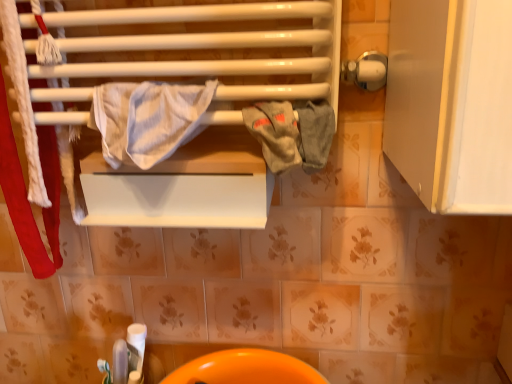
Question: Would you say gray cotton towel at center, the second bath towel when ordered from left to right, contains orange glossy sink at lower center?

Choices:
 (A) yes
 (B) no

Answer: (B)

Question: Does gray cotton towel at center, the second bath towel when ordered from left to right, have a larger size compared to orange glossy sink at lower center?

Choices:
 (A) yes
 (B) no

Answer: (B)

Question: Considering the relative sizes of gray cotton towel at center, the second bath towel when ordered from left to right, and orange glossy sink at lower center in the image provided, is gray cotton towel at center, the second bath towel when ordered from left to right, smaller than orange glossy sink at lower center?

Choices:
 (A) yes
 (B) no

Answer: (A)

Question: Considering the relative positions of gray cotton towel at center, the second bath towel when ordered from left to right, and orange glossy sink at lower center in the image provided, is gray cotton towel at center, the second bath towel when ordered from left to right, to the right of orange glossy sink at lower center from the viewer's perspective?

Choices:
 (A) no
 (B) yes

Answer: (B)

Question: Is gray cotton towel at center, the second bath towel when ordered from left to right, located outside orange glossy sink at lower center?

Choices:
 (A) no
 (B) yes

Answer: (B)

Question: From the image's perspective, relative to orange glossy sink at lower center, is gray cotton towel at center, which is the 1th bath towel from right to left, above or below?

Choices:
 (A) below
 (B) above

Answer: (B)

Question: In the image, is gray cotton towel at center, the second bath towel when ordered from left to right, positioned in front of or behind orange glossy sink at lower center?

Choices:
 (A) behind
 (B) front

Answer: (B)

Question: Is gray cotton towel at center, the second bath towel when ordered from left to right, taller or shorter than orange glossy sink at lower center?

Choices:
 (A) short
 (B) tall

Answer: (A)

Question: Considering the relative positions of gray cotton towel at center, the second bath towel when ordered from left to right, and orange glossy sink at lower center in the image provided, is gray cotton towel at center, the second bath towel when ordered from left to right, to the left or to the right of orange glossy sink at lower center?

Choices:
 (A) right
 (B) left

Answer: (A)

Question: From the image's perspective, is orange glossy sink at lower center positioned above or below white striped fabric at center, which appears as the 2th bath towel when viewed from the right?

Choices:
 (A) below
 (B) above

Answer: (A)

Question: From their relative heights in the image, would you say orange glossy sink at lower center is taller or shorter than white striped fabric at center, which is the first bath towel from left to right?

Choices:
 (A) short
 (B) tall

Answer: (A)

Question: Is point (292, 379) closer or farther from the camera than point (125, 127)?

Choices:
 (A) closer
 (B) farther

Answer: (B)

Question: Which is correct: orange glossy sink at lower center is inside white striped fabric at center, which appears as the 2th bath towel when viewed from the right, or outside of it?

Choices:
 (A) inside
 (B) outside

Answer: (B)

Question: From the image's perspective, is gray cotton towel at center, the second bath towel when ordered from left to right, above or below white striped fabric at center, which appears as the 2th bath towel when viewed from the right?

Choices:
 (A) above
 (B) below

Answer: (B)

Question: Considering the positions of gray cotton towel at center, the second bath towel when ordered from left to right, and white striped fabric at center, which is the first bath towel from left to right, in the image, is gray cotton towel at center, the second bath towel when ordered from left to right, bigger or smaller than white striped fabric at center, which is the first bath towel from left to right,?

Choices:
 (A) small
 (B) big

Answer: (A)